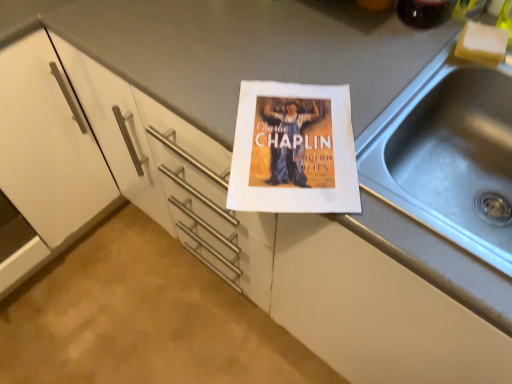
Question: From the image's perspective, relative to white sponge at upper right, is translucent glass beverage at upper right above or below?

Choices:
 (A) above
 (B) below

Answer: (A)

Question: From a real-world perspective, relative to white sponge at upper right, is translucent glass beverage at upper right vertically above or below?

Choices:
 (A) above
 (B) below

Answer: (A)

Question: Estimate the real-world distances between objects in this image. Which object is farther from the white sponge at upper right?

Choices:
 (A) silver metallic sink at right
 (B) translucent glass beverage at upper right

Answer: (A)

Question: Based on their relative distances, which object is farther from the translucent glass beverage at upper right?

Choices:
 (A) white sponge at upper right
 (B) silver metallic sink at right

Answer: (B)